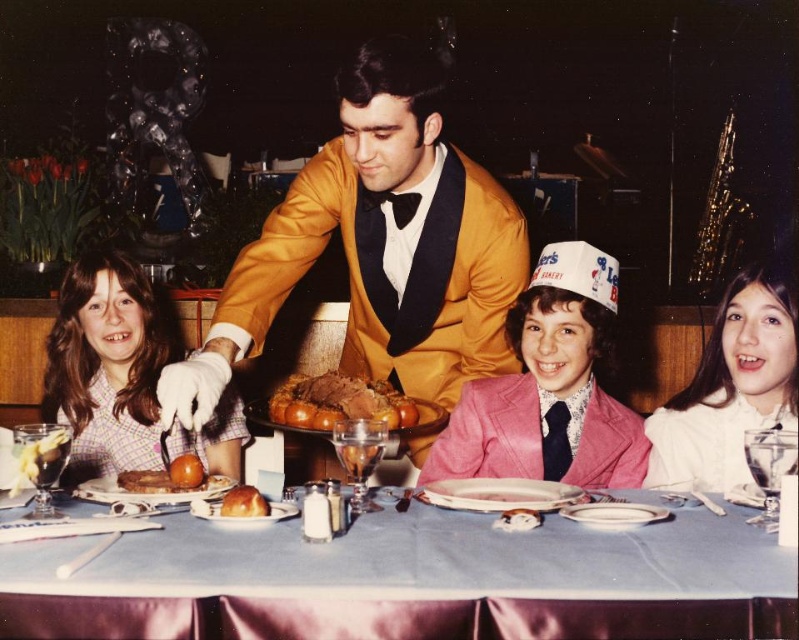
Question: Among these points, which one is farthest from the camera?

Choices:
 (A) (205, 544)
 (B) (344, 376)

Answer: (B)

Question: Can you confirm if plaid fabric shirt at left is positioned to the left of smooth golden apple at lower left?

Choices:
 (A) yes
 (B) no

Answer: (A)

Question: Among these points, which one is farthest from the camera?

Choices:
 (A) click(197, 477)
 (B) click(165, 467)

Answer: (B)

Question: Among these objects, which one is nearest to the camera?

Choices:
 (A) pink satin suit at center
 (B) smooth golden apple at lower left

Answer: (B)

Question: Does plaid fabric shirt at left have a lesser width compared to golden brown roasted meat at center?

Choices:
 (A) no
 (B) yes

Answer: (A)

Question: Does gold satin tuxedo at center have a greater width compared to orange glazed donut at center?

Choices:
 (A) no
 (B) yes

Answer: (B)